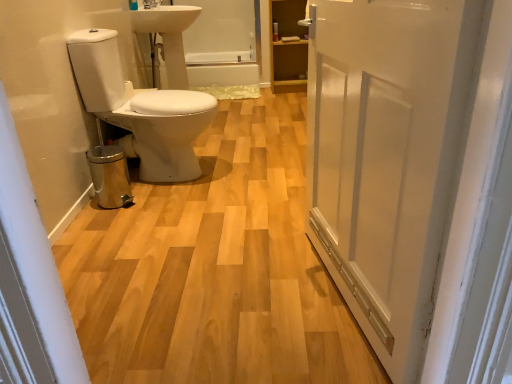
Image resolution: width=512 pixels, height=384 pixels. What do you see at coordinates (168, 35) in the screenshot?
I see `white glossy sink at upper center` at bounding box center [168, 35].

At what (x,y) coordinates should I click in order to perform the action: click on glossy ceramic tap at upper center. Please return your answer as a coordinate pair (x, y). The width and height of the screenshot is (512, 384). Looking at the image, I should click on (151, 4).

What do you see at coordinates (151, 4) in the screenshot? I see `glossy ceramic tap at upper center` at bounding box center [151, 4].

Image resolution: width=512 pixels, height=384 pixels. In order to click on white glossy bathtub at center in this screenshot , I will do `click(221, 71)`.

Locate an element on the screen. white glossy sink at upper center is located at coordinates (168, 35).

How many degrees apart are the facing directions of white matte door at center and white glossy bathtub at center?

The angular difference between white matte door at center and white glossy bathtub at center is 76.3 degrees.

Is white matte door at center thinner than white glossy bathtub at center?

Yes.

Considering their positions, is white matte door at center located in front of or behind white glossy bathtub at center?

white matte door at center is in front of white glossy bathtub at center.

Who is taller, white glossy toilet at left or white glossy sink at upper center?

white glossy toilet at left is taller.

Is white glossy toilet at left oriented away from white glossy sink at upper center?

white glossy toilet at left does not have its back to white glossy sink at upper center.

From a real-world perspective, which object rests below the other?

In real-world perspective, white glossy toilet at left is lower.

Relative to white glossy sink at upper center, is white glossy toilet at left in front or behind?

white glossy toilet at left is in front of white glossy sink at upper center.

From a real-world perspective, relative to white glossy sink at upper center, is white glossy toilet at left vertically above or below?

white glossy toilet at left is below white glossy sink at upper center.

From the picture: Is white glossy toilet at left to the left of white glossy sink at upper center from the viewer's perspective?

No, white glossy toilet at left is not to the left of white glossy sink at upper center.

Looking at the image, does white matte door at center seem bigger or smaller compared to wooden cabinet at upper right?

Clearly, white matte door at center is larger in size than wooden cabinet at upper right.

How many degrees apart are the facing directions of white matte door at center and wooden cabinet at upper right?

white matte door at center and wooden cabinet at upper right are facing 76.7 degrees away from each other.

Is white matte door at center taller than wooden cabinet at upper right?

Yes.

At what (x,y) coordinates should I click in order to perform the action: click on medicine cabinet behind the white matte door at center. Please return your answer as a coordinate pair (x, y). This screenshot has width=512, height=384. Looking at the image, I should click on (288, 47).

Would you say white matte door at center is to the left or to the right of white glossy sink at upper center in the picture?

white matte door at center is positioned on white glossy sink at upper center's right side.

Is white matte door at center inside the boundaries of white glossy sink at upper center, or outside?

The correct answer is: outside.

From a real-world perspective, is white matte door at center physically below white glossy sink at upper center?

Actually, white matte door at center is physically above white glossy sink at upper center in the real world.

From a real-world perspective, is white glossy sink at upper center located beneath white glossy toilet at left?

Incorrect, from a real-world perspective, white glossy sink at upper center is higher than white glossy toilet at left.

Based on the photo, considering the positions of objects white glossy sink at upper center and white glossy toilet at left in the image provided, who is more to the left, white glossy sink at upper center or white glossy toilet at left?

white glossy sink at upper center.

From the image's perspective, is white glossy sink at upper center above or below white glossy toilet at left?

Clearly, from the image's perspective, white glossy sink at upper center is above white glossy toilet at left.

Between white glossy sink at upper center and white matte door at center, which one has less height?

Standing shorter between the two is white glossy sink at upper center.

How many degrees apart are the facing directions of white glossy sink at upper center and white matte door at center?

The angle between the facing direction of white glossy sink at upper center and the facing direction of white matte door at center is 169 degrees.

From the image's perspective, is white glossy sink at upper center positioned above or below white matte door at center?

white glossy sink at upper center is above white matte door at center.

Image resolution: width=512 pixels, height=384 pixels. In order to click on bath on the left of the white matte door at center in this screenshot , I will do `click(221, 71)`.

Locate an element on the screen. The width and height of the screenshot is (512, 384). open on the right of the white glossy sink at upper center is located at coordinates (140, 109).

Considering their positions, is glossy ceramic tap at upper center positioned further to wooden cabinet at upper right than white glossy toilet at left?

Among the two, white glossy toilet at left is located further to wooden cabinet at upper right.

Which object lies further to the anchor point glossy ceramic tap at upper center, white glossy toilet at left or white glossy sink at upper center?

The object further to glossy ceramic tap at upper center is white glossy toilet at left.

Consider the image. Looking at the image, which one is located further to white glossy toilet at left, white glossy bathtub at center or white matte door at center?

The object further to white glossy toilet at left is white glossy bathtub at center.

In the scene shown: When comparing their distances from glossy ceramic tap at upper center, does white glossy toilet at left or white glossy bathtub at center seem further?

Based on the image, white glossy bathtub at center appears to be further to glossy ceramic tap at upper center.

Looking at the image, which one is located closer to white glossy toilet at left, white glossy bathtub at center or white matte door at center?

The object closer to white glossy toilet at left is white matte door at center.

From the image, which object appears to be farther from wooden cabinet at upper right, white glossy sink at upper center or white matte door at center?

The object further to wooden cabinet at upper right is white matte door at center.

From the image, which object appears to be farther from glossy ceramic tap at upper center, white glossy bathtub at center or white glossy toilet at left?

The object further to glossy ceramic tap at upper center is white glossy toilet at left.

From the image, which object appears to be nearer to white glossy sink at upper center, white matte door at center or white glossy toilet at left?

The object closer to white glossy sink at upper center is white glossy toilet at left.

Where is `open between white glossy toilet at left and white glossy sink at upper center from front to back`? open between white glossy toilet at left and white glossy sink at upper center from front to back is located at coordinates (140, 109).

This screenshot has width=512, height=384. In order to click on sink located between white matte door at center and wooden cabinet at upper right in the depth direction in this screenshot , I will do `click(168, 35)`.

In order to click on plain positioned between white matte door at center and white glossy toilet at left from near to far in this screenshot , I will do `click(214, 268)`.

Locate an element on the screen. medicine cabinet between white glossy toilet at left and white glossy bathtub at center in the front-back direction is located at coordinates (288, 47).